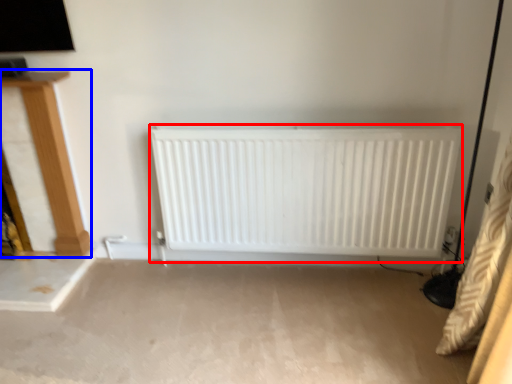
Question: Which of the following is the closest to the observer, radiator (highlighted by a red box) or furniture (highlighted by a blue box)?

Choices:
 (A) radiator
 (B) furniture

Answer: (A)